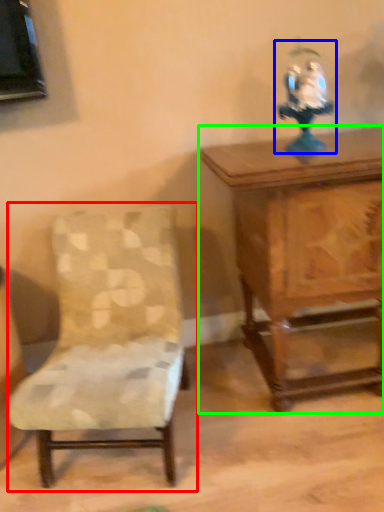
Question: Which object is the closest to the chair (highlighted by a red box)? Choose among these: toy (highlighted by a blue box) or table (highlighted by a green box).

Choices:
 (A) toy
 (B) table

Answer: (B)